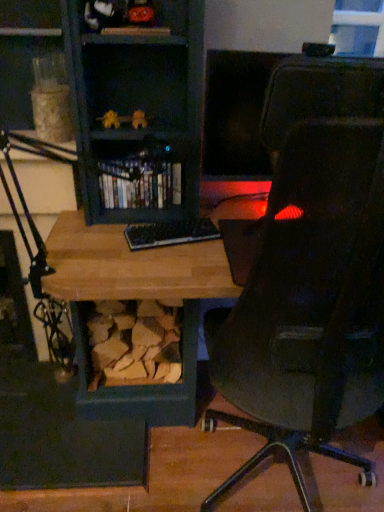
Question: Should I look upward or downward to see transparent glass window at upper right?

Choices:
 (A) up
 (B) down

Answer: (A)

Question: Is shiny plastic books at center oriented towards transparent glass window at upper right?

Choices:
 (A) yes
 (B) no

Answer: (B)

Question: Does shiny plastic books at center have a greater height compared to transparent glass window at upper right?

Choices:
 (A) yes
 (B) no

Answer: (B)

Question: Does shiny plastic books at center have a lesser width compared to transparent glass window at upper right?

Choices:
 (A) yes
 (B) no

Answer: (B)

Question: From a real-world perspective, is shiny plastic books at center on transparent glass window at upper right?

Choices:
 (A) yes
 (B) no

Answer: (B)

Question: Is shiny plastic books at center closer to the viewer compared to transparent glass window at upper right?

Choices:
 (A) no
 (B) yes

Answer: (B)

Question: From a real-world perspective, is shiny plastic books at center physically below transparent glass window at upper right?

Choices:
 (A) no
 (B) yes

Answer: (B)

Question: Does transparent glass window at upper right appear on the left side of shiny plastic books at center?

Choices:
 (A) no
 (B) yes

Answer: (A)

Question: From a real-world perspective, does transparent glass window at upper right stand above shiny plastic books at center?

Choices:
 (A) no
 (B) yes

Answer: (B)

Question: Considering the relative sizes of transparent glass window at upper right and shiny plastic books at center in the image provided, is transparent glass window at upper right shorter than shiny plastic books at center?

Choices:
 (A) no
 (B) yes

Answer: (A)

Question: Is transparent glass window at upper right oriented away from shiny plastic books at center?

Choices:
 (A) yes
 (B) no

Answer: (B)

Question: From the image's perspective, would you say transparent glass window at upper right is positioned over shiny plastic books at center?

Choices:
 (A) yes
 (B) no

Answer: (A)

Question: Is shiny plastic books at center a part of transparent glass window at upper right?

Choices:
 (A) no
 (B) yes

Answer: (A)

Question: Considering the relative sizes of transparent glass window at upper right and black plastic keyboard at center in the image provided, is transparent glass window at upper right smaller than black plastic keyboard at center?

Choices:
 (A) yes
 (B) no

Answer: (B)